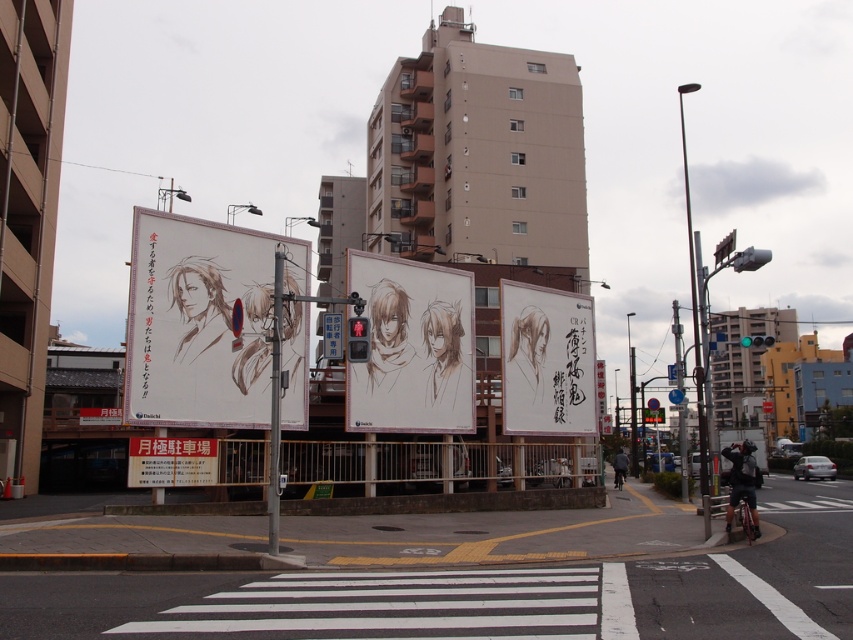
Question: Is matte paper poster at center positioned before brown sketch at center?

Choices:
 (A) no
 (B) yes

Answer: (B)

Question: Which object is positioned farthest from the dark blue jacket at lower right?

Choices:
 (A) brown sketch at center
 (B) matte paper poster at center
 (C) dark gray jacket at lower right
 (D) white paper sign at lower left

Answer: (C)

Question: Among these points, which one is farthest from the camera?

Choices:
 (A) (735, 493)
 (B) (619, 456)
 (C) (555, 433)

Answer: (B)

Question: Can you confirm if dark blue jacket at lower right is positioned above dark gray jacket at lower right?

Choices:
 (A) no
 (B) yes

Answer: (B)

Question: Is matte paper poster at center to the left of white paper sign at lower left from the viewer's perspective?

Choices:
 (A) no
 (B) yes

Answer: (A)

Question: Among these objects, which one is nearest to the camera?

Choices:
 (A) brown sketch at center
 (B) white paper billboard at center
 (C) dark gray jacket at lower right
 (D) matte paper poster at center

Answer: (D)